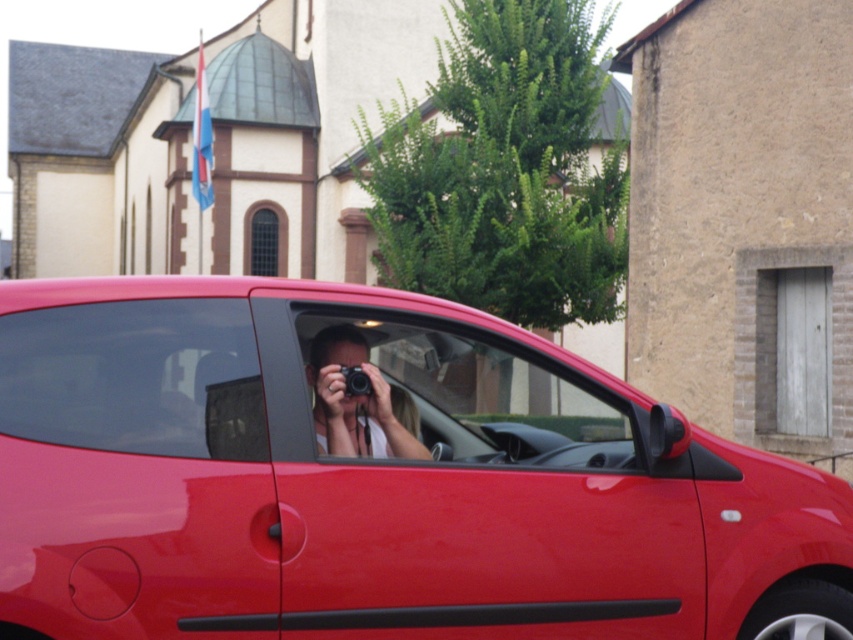
From the picture: You are a photographer standing in front of the glossy red car at center and the transparent glass at center. Which object is nearer to you?

The glossy red car at center is closer to the viewer than the transparent glass at center.

You are standing in front of the red car parked near the building with the dome. You notice two points marked on the car. The first point is at coordinates point (607, 452) and the second is at point (389, 424). If you were to reach out and touch both points, which one would you have to extend your hand further to reach?

Point (607, 452) is further to the camera than point (389, 424), so you would have to extend your hand further to reach point (607, 452).

You are a delivery person who needs to load a large package into a vehicle. You see the glossy red car at center and the transparent glass at center. Which vehicle can you load your package into?

The glossy red car at center is bigger than transparent glass at center, so the glossy red car at center is the vehicle you can load your package into.